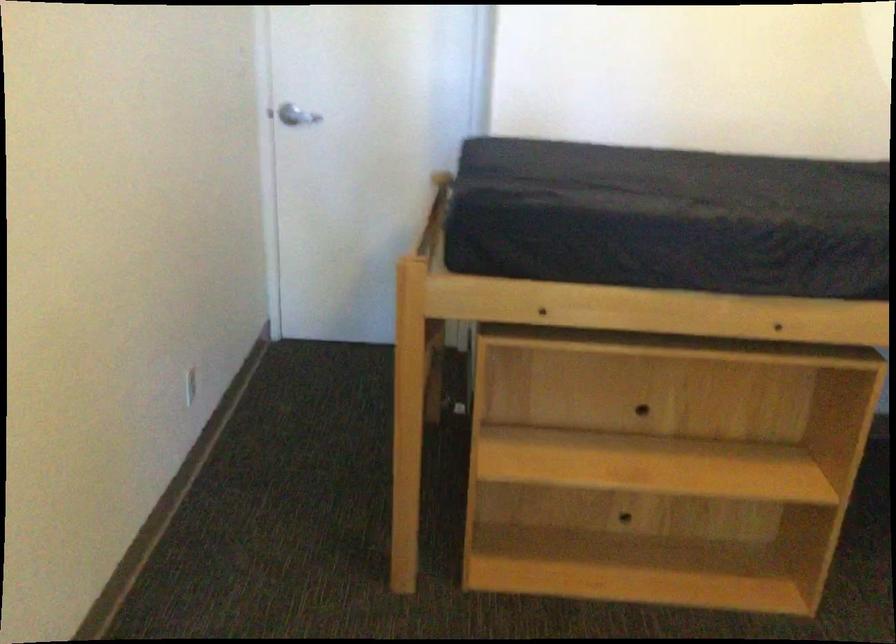
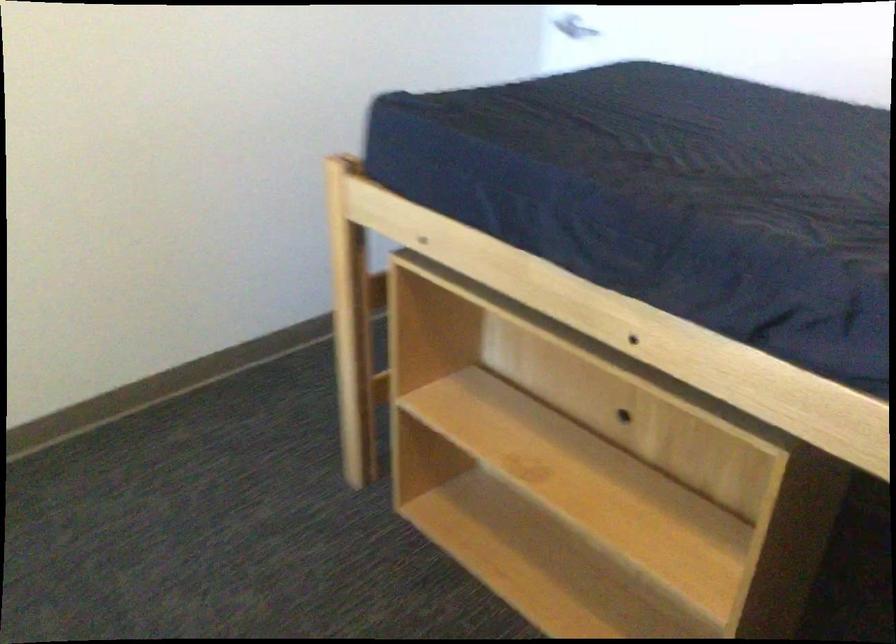
Locate, in the second image, the point that corresponds to (x=399, y=491) in the first image.

(377, 397)